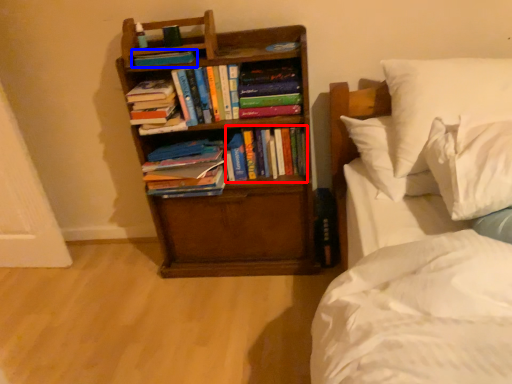
Question: Which of the following is the closest to the observer, book (highlighted by a red box) or book (highlighted by a blue box)?

Choices:
 (A) book
 (B) book

Answer: (B)